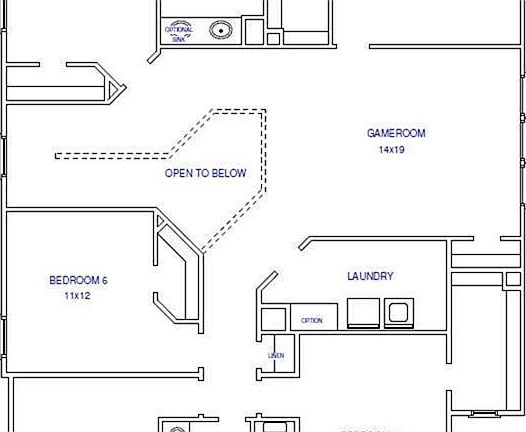
Locate an element on the screen. The height and width of the screenshot is (432, 526). gameroom is located at coordinates (432, 185).